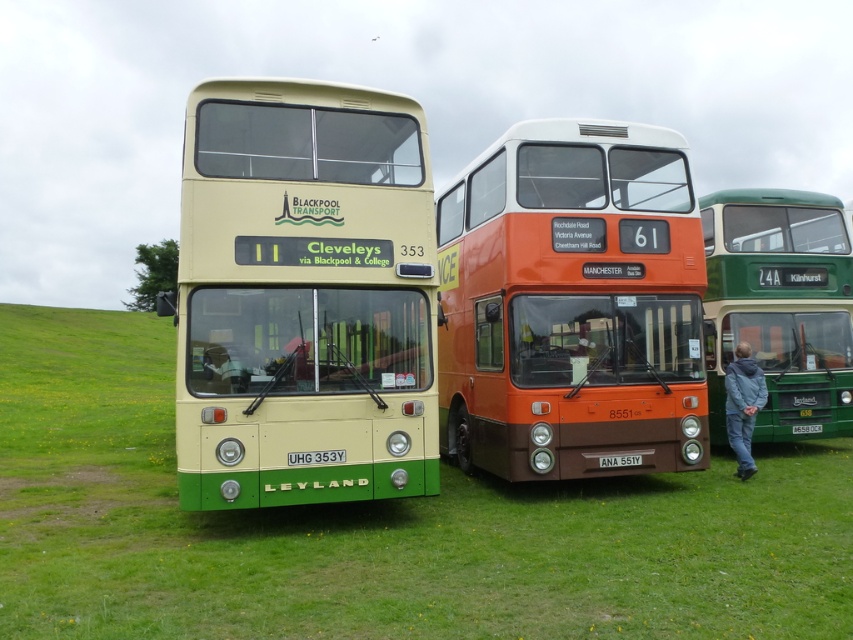
Question: Which of the following is the closest to the observer?

Choices:
 (A) (496, 468)
 (B) (358, 150)
 (C) (724, 241)
 (D) (793, 433)

Answer: (B)

Question: Which point is farther to the camera?

Choices:
 (A) green matte license plate at center
 (B) green matte bus at center

Answer: (A)

Question: From the image, what is the correct spatial relationship of orange metallic bus at center in relation to green matte license plate at center?

Choices:
 (A) above
 (B) below

Answer: (A)

Question: Is orange metallic bus at center to the left of green matte license plate at center from the viewer's perspective?

Choices:
 (A) no
 (B) yes

Answer: (B)

Question: Among these points, which one is nearest to the camera?

Choices:
 (A) [798, 429]
 (B) [749, 380]

Answer: (B)

Question: Can you confirm if gray fabric jacket at lower right is bigger than red plastic license plate at center?

Choices:
 (A) no
 (B) yes

Answer: (B)